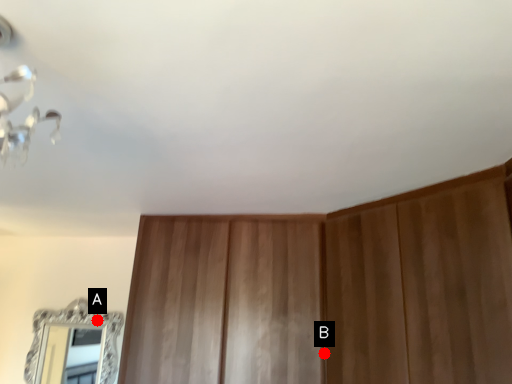
Question: Two points are circled on the image, labeled by A and B beside each circle. Which point is closer to the camera taking this photo?

Choices:
 (A) A is closer
 (B) B is closer

Answer: (B)